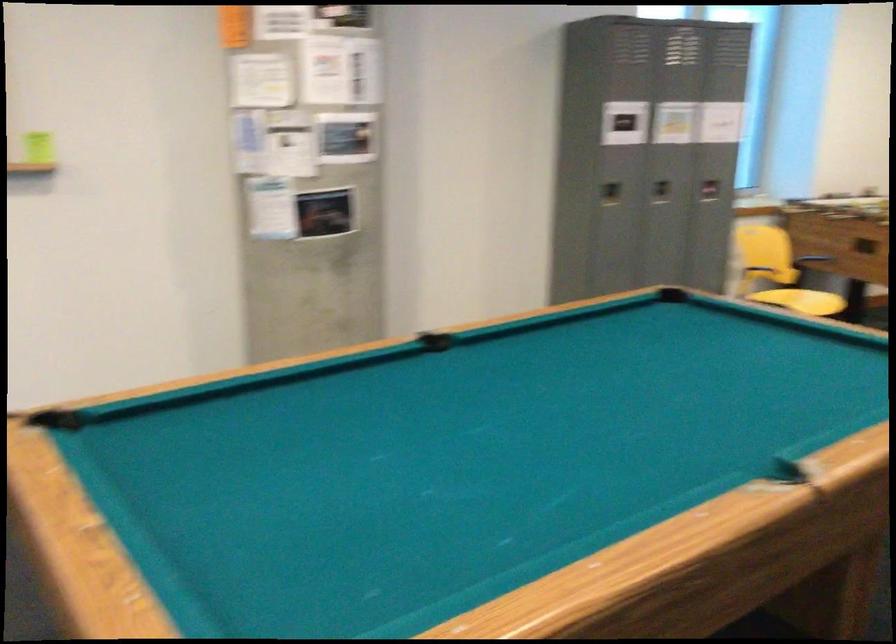
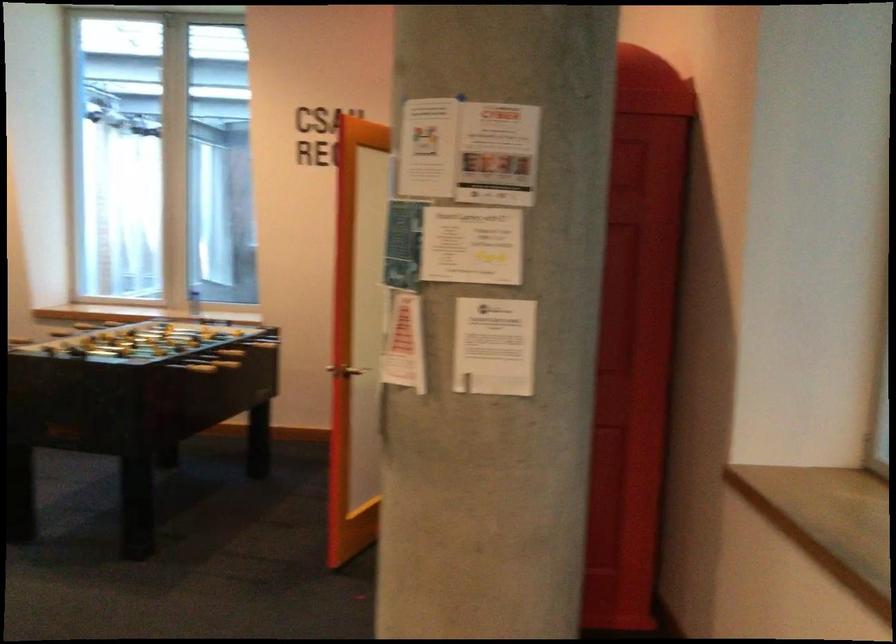
Question: The images are taken continuously from a first-person perspective. In which direction is your viewpoint rotating?

Choices:
 (A) Left
 (B) Right
 (C) Up
 (D) Down

Answer: (B)